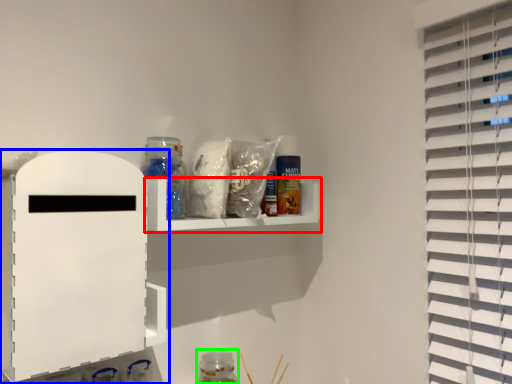
Question: Which object is the closest to the shelf (highlighted by a red box)? Choose among these: shelf (highlighted by a blue box) or bottle (highlighted by a green box).

Choices:
 (A) shelf
 (B) bottle

Answer: (A)